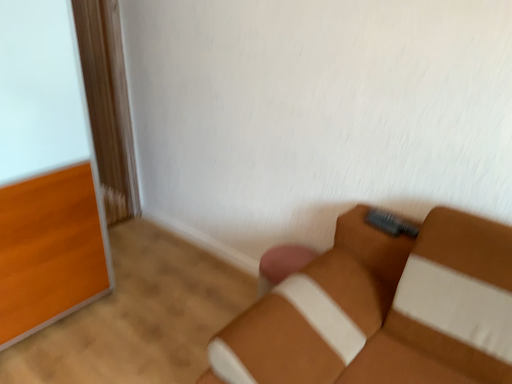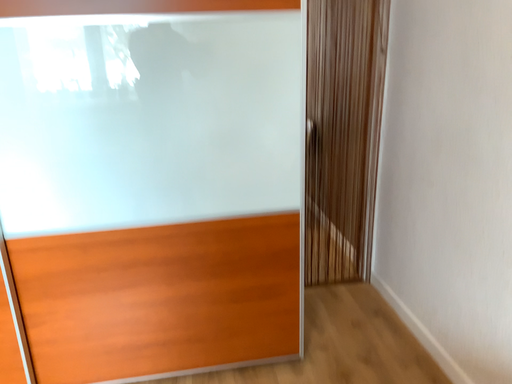
Question: Which way did the camera rotate in the video?

Choices:
 (A) rotated right
 (B) rotated left

Answer: (B)